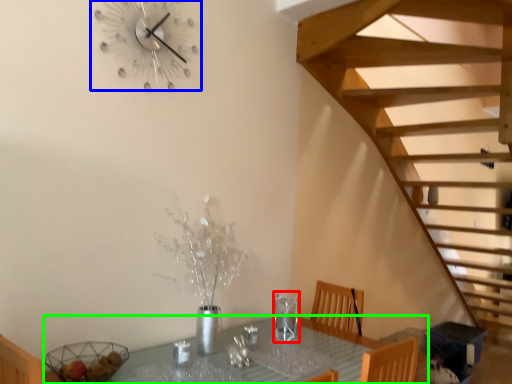
Question: Considering the real-world distances, which object is farthest from wine glass (highlighted by a red box)? wall clock (highlighted by a blue box) or table (highlighted by a green box)?

Choices:
 (A) wall clock
 (B) table

Answer: (A)